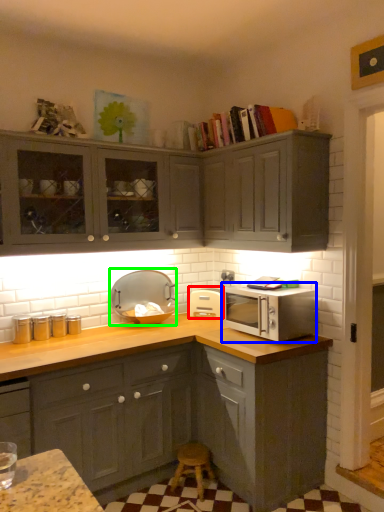
Question: Considering the real-world distances, which object is farthest from appliance (highlighted by a red box)? microwave oven (highlighted by a blue box) or appliance (highlighted by a green box)?

Choices:
 (A) microwave oven
 (B) appliance

Answer: (A)